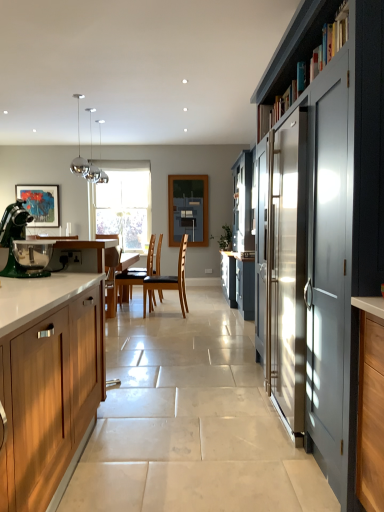
Question: Considering the relative positions of green matte stand mixer at left and wooden cabinet at left, placed as the 1th cabinetry when sorted from left to right, in the image provided, is green matte stand mixer at left to the right of wooden cabinet at left, placed as the 1th cabinetry when sorted from left to right, from the viewer's perspective?

Choices:
 (A) yes
 (B) no

Answer: (B)

Question: Can wooden cabinet at left, placed as the 1th cabinetry when sorted from left to right, be found inside green matte stand mixer at left?

Choices:
 (A) no
 (B) yes

Answer: (A)

Question: Is green matte stand mixer at left shorter than wooden cabinet at left, which is counted as the 2th cabinetry, starting from the right?

Choices:
 (A) no
 (B) yes

Answer: (B)

Question: Considering the relative sizes of green matte stand mixer at left and wooden cabinet at left, which is counted as the 2th cabinetry, starting from the right, in the image provided, is green matte stand mixer at left smaller than wooden cabinet at left, which is counted as the 2th cabinetry, starting from the right,?

Choices:
 (A) yes
 (B) no

Answer: (A)

Question: Is green matte stand mixer at left located outside wooden cabinet at left, placed as the 1th cabinetry when sorted from left to right?

Choices:
 (A) yes
 (B) no

Answer: (B)

Question: Is green matte stand mixer at left with wooden cabinet at left, which is counted as the 2th cabinetry, starting from the right?

Choices:
 (A) no
 (B) yes

Answer: (A)

Question: Is chrome/metallic pendant lights at upper left not inside brown leather chair at center, the second chair in the back-to-front sequence?

Choices:
 (A) no
 (B) yes

Answer: (B)

Question: Is chrome/metallic pendant lights at upper left bigger than brown leather chair at center, which is counted as the 2th chair, starting from the left?

Choices:
 (A) no
 (B) yes

Answer: (A)

Question: Is chrome/metallic pendant lights at upper left smaller than brown leather chair at center, the second chair in the back-to-front sequence?

Choices:
 (A) no
 (B) yes

Answer: (B)

Question: From a real-world perspective, does chrome/metallic pendant lights at upper left sit lower than brown leather chair at center, which is counted as the 2th chair, starting from the left?

Choices:
 (A) yes
 (B) no

Answer: (B)

Question: Is chrome/metallic pendant lights at upper left shorter than brown leather chair at center, which is counted as the 2th chair, starting from the left?

Choices:
 (A) no
 (B) yes

Answer: (B)

Question: From the image's perspective, is chrome/metallic pendant lights at upper left located beneath brown leather chair at center, the second chair in the back-to-front sequence?

Choices:
 (A) no
 (B) yes

Answer: (A)

Question: From a real-world perspective, is matte acrylic painting at left over chrome/metallic pendant lights at upper left?

Choices:
 (A) yes
 (B) no

Answer: (B)